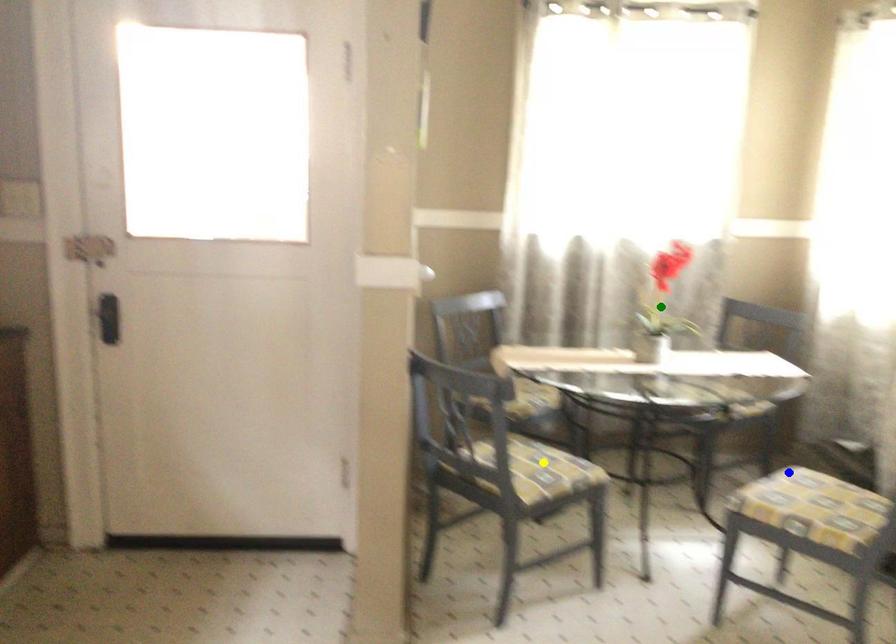
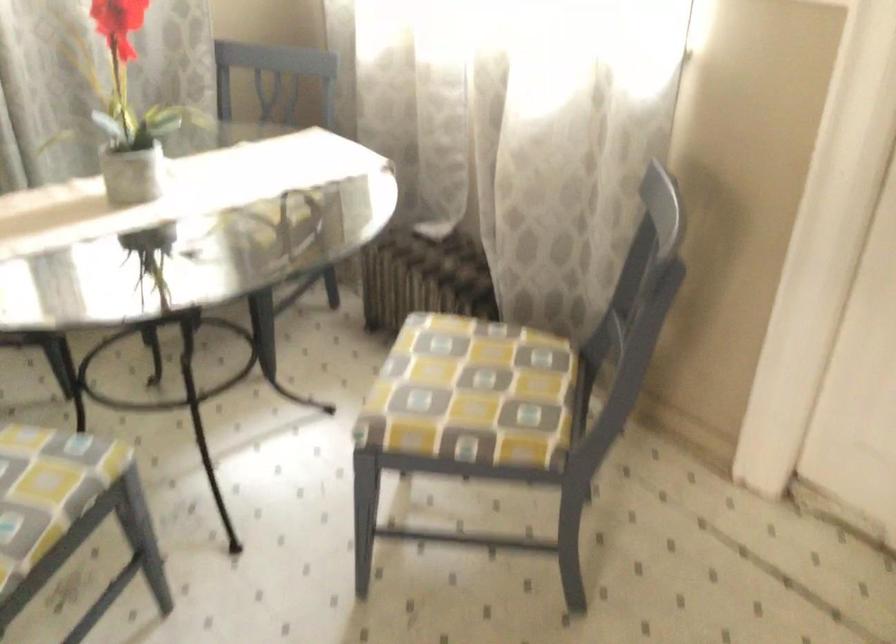
I am providing you with two images of the same scene from different viewpoints. Three points are marked in image1. Which point corresponds to a part or object that is occluded in image2?In image1, three points are marked. Which of them correspond to a part or object that is occluded in image2?Among the three points shown in image1, which one corresponds to a part or object that is no longer visible due to occlusion in image2?

green point cannot be seen in image2.